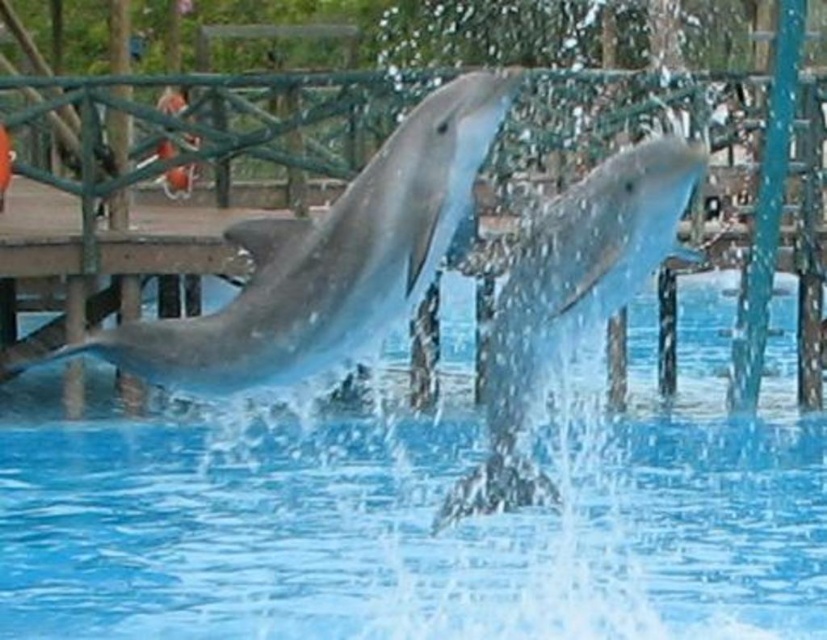
You are a marine biologist observing two dolphins in a marine park. You notice a smooth gray dolphin at center and a slick gray dolphin at center. Which dolphin is positioned higher in the water? Please base your answer on their positions in the image.

The smooth gray dolphin at center is positioned higher in the water because it is located above the slick gray dolphin at center according to the description.

You are a photographer trying to capture a clear image of the smooth gray dolphin at center. However, the clear blue water at center is obstructing your view. Can you adjust your position to see the dolphin through the water?

The smooth gray dolphin at center is behind the clear blue water at center, so yes, you can adjust your position to see the dolphin through the water since it is positioned behind the water.